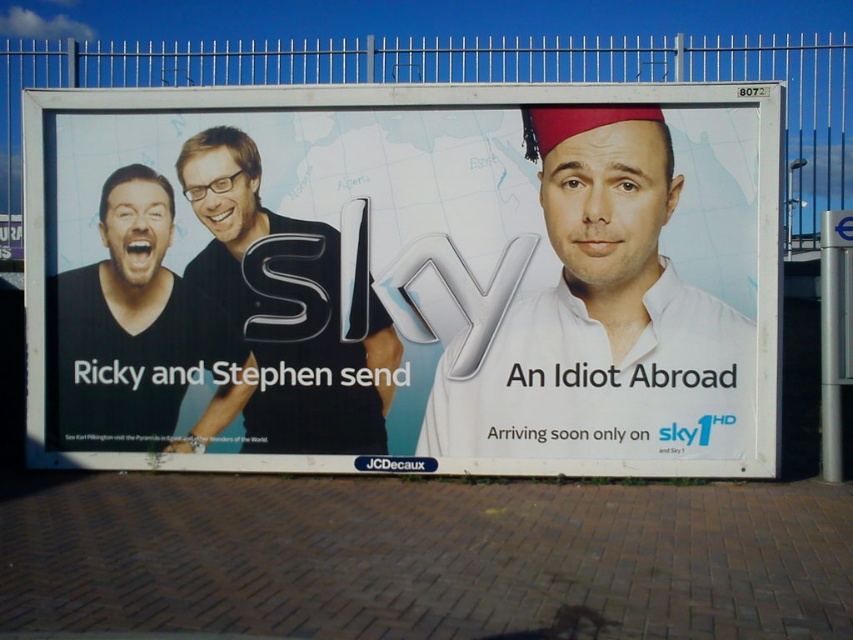
You are a drone operator trying to capture a closeup of the billboard. You have two points marked on the billboard for reference. The first point is at point (570, 220) and the second point is at point (120, 275). If you want to focus on the point that is closer to the front of the billboard, which point should you choose?

Point (570, 220) is in front of point (120, 275), so you should choose point (570, 220) to focus on the closer point.